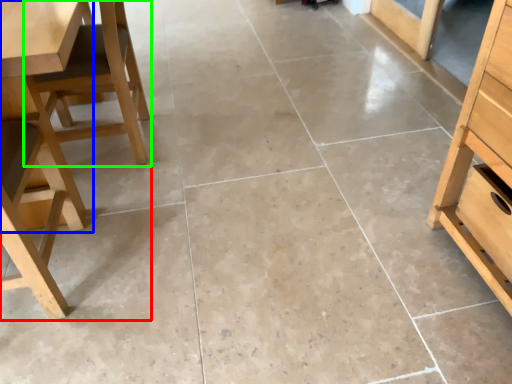
Question: Considering the real-world distances, which object is closest to chair (highlighted by a red box)? table (highlighted by a blue box) or chair (highlighted by a green box).

Choices:
 (A) table
 (B) chair

Answer: (B)